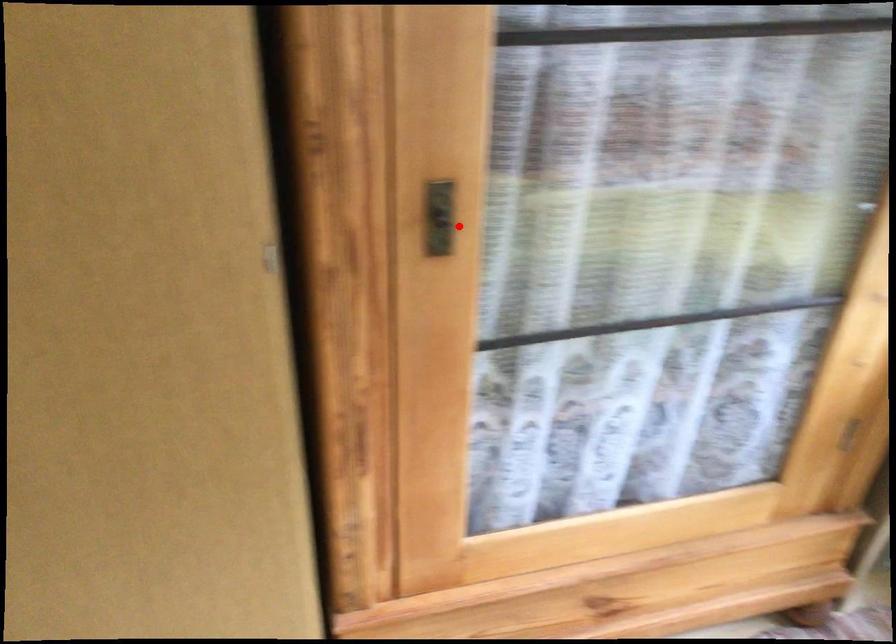
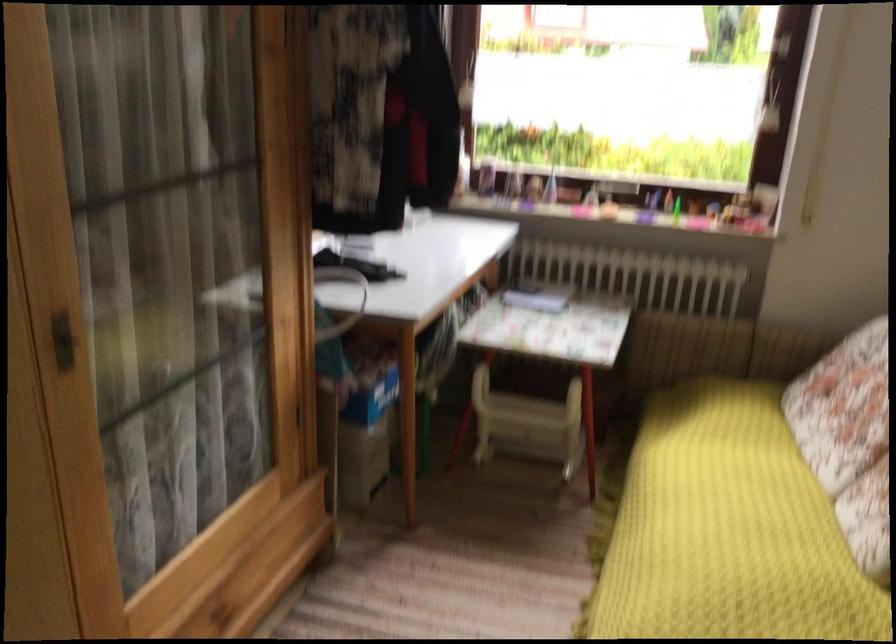
Where in the second image is the point corresponding to the highlighted location from the first image?

(63, 341)